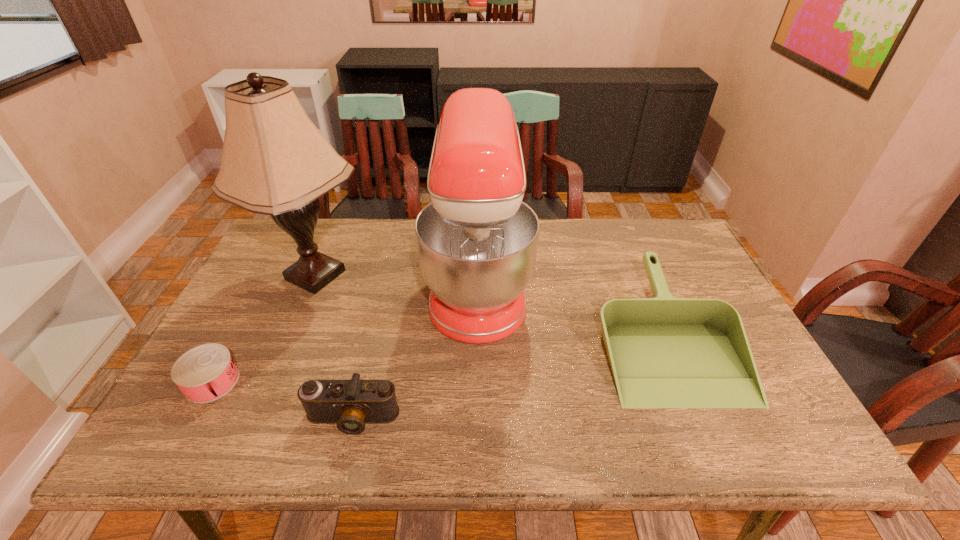
Locate an element on the screen. The image size is (960, 540). lamp is located at coordinates (275, 161).

This screenshot has height=540, width=960. Find the location of `mixer`. mixer is located at coordinates (477, 242).

The width and height of the screenshot is (960, 540). In order to click on the second object from right to left in this screenshot , I will do `click(477, 242)`.

This screenshot has height=540, width=960. What are the coordinates of `dustpan` in the screenshot? It's located at (664, 352).

You are a GUI agent. You are given a task and a screenshot of the screen. Output one action in this format:
    pyautogui.click(x=<x>, y=<y>)
    Task: Click on the camera
    This screenshot has height=540, width=960.
    Given the screenshot: What is the action you would take?
    pyautogui.click(x=350, y=404)

In order to click on the shortest object in this screenshot , I will do tap(203, 374).

Locate an element on the screen. The width and height of the screenshot is (960, 540). free spot located on the right of the lamp is located at coordinates (468, 275).

Find the location of a particular element. The width and height of the screenshot is (960, 540). free space located on the front-facing side of the fourth object from left to right is located at coordinates (559, 283).

You are a GUI agent. You are given a task and a screenshot of the screen. Output one action in this format:
    pyautogui.click(x=<x>, y=<y>)
    Task: Click on the vacant position located 0.090m on the scoop of the rightmost object
    This screenshot has height=540, width=960.
    Given the screenshot: What is the action you would take?
    pyautogui.click(x=711, y=447)

Find the location of a particular element. vacant space located 0.060m on the back of the can is located at coordinates (233, 342).